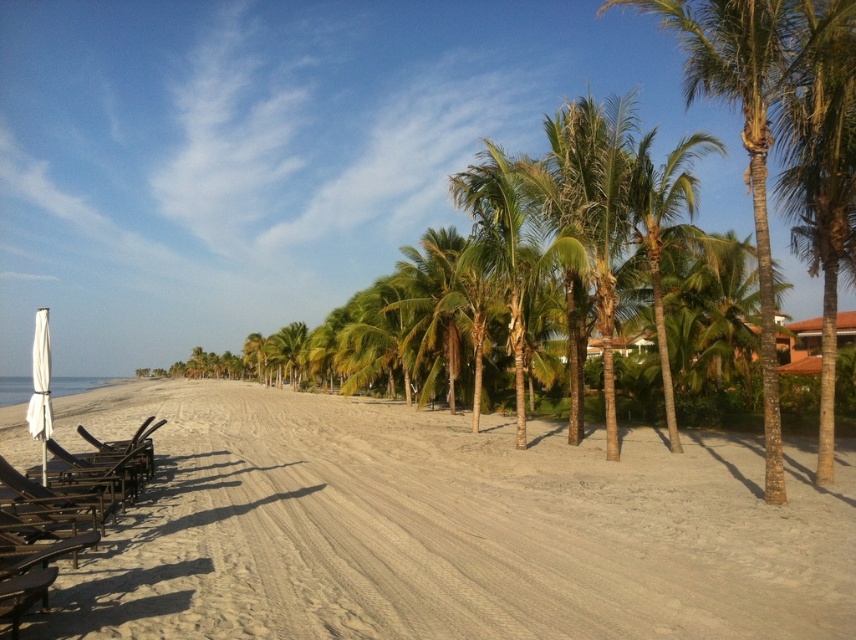
Question: Which is farther from the white fabric umbrella at left?

Choices:
 (A) beige sandy beach at center
 (B) metallic black beach chair at left

Answer: (A)

Question: Can you confirm if wooden beach chair at left is positioned to the left of white fabric umbrella at left?

Choices:
 (A) yes
 (B) no

Answer: (B)

Question: Does beige sandy beach at center have a greater width compared to wooden beach chair at left?

Choices:
 (A) no
 (B) yes

Answer: (B)

Question: Among these objects, which one is farthest from the camera?

Choices:
 (A) metallic black beach chair at left
 (B) beige sandy beach at center
 (C) wooden beach chair at left
 (D) white fabric umbrella at left

Answer: (D)

Question: Is beige sandy beach at center bigger than white fabric umbrella at left?

Choices:
 (A) yes
 (B) no

Answer: (B)

Question: Which of the following is the closest to the observer?

Choices:
 (A) beige sandy beach at center
 (B) metallic black beach chair at left

Answer: (A)